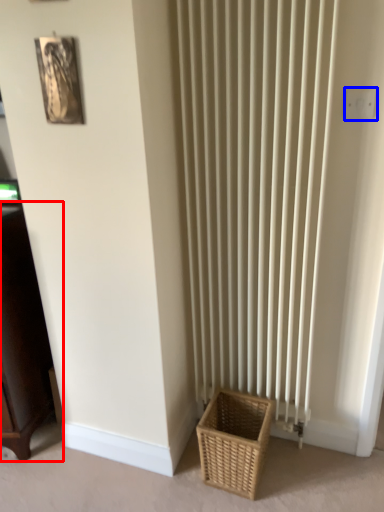
Question: Which of the following is the farthest to the observer, furniture (highlighted by a red box) or electric outlet (highlighted by a blue box)?

Choices:
 (A) furniture
 (B) electric outlet

Answer: (A)